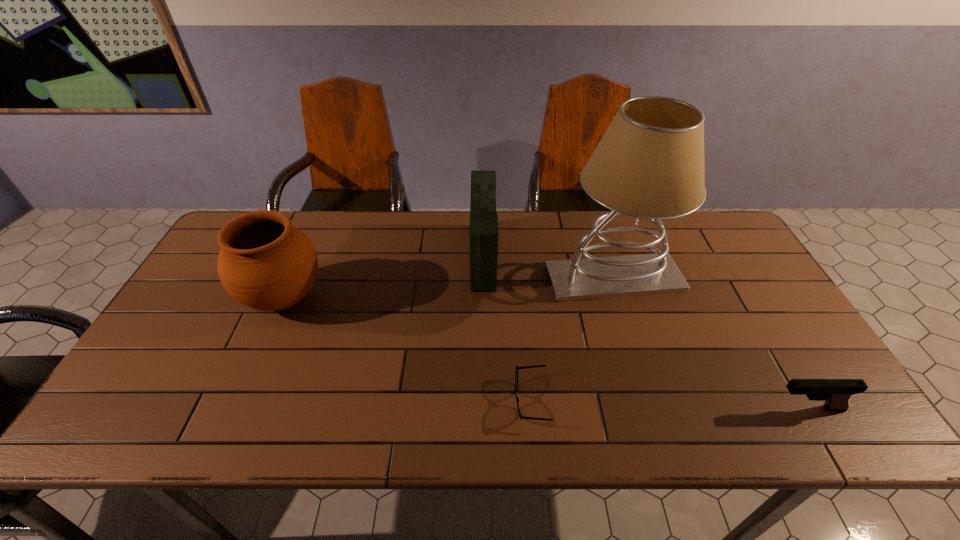
Identify the location of the first-aid kit that is at the far edge. This screenshot has width=960, height=540. (483, 218).

Find the location of `pistol that is at the near edge`. pistol that is at the near edge is located at coordinates (836, 393).

Locate an element on the screen. spectacles that is at the near edge is located at coordinates (524, 367).

Where is `object that is at the left edge`? object that is at the left edge is located at coordinates (265, 263).

At what (x,y) coordinates should I click in order to perform the action: click on object that is at the right edge. Please return your answer as a coordinate pair (x, y). The image size is (960, 540). Looking at the image, I should click on [836, 393].

At what (x,y) coordinates should I click in order to perform the action: click on object that is at the near right corner. Please return your answer as a coordinate pair (x, y). This screenshot has height=540, width=960. Looking at the image, I should click on (836, 393).

In the image, there is a desktop. What are the coordinates of `free space at the far edge` in the screenshot? It's located at (319, 251).

This screenshot has height=540, width=960. In the image, there is a desktop. In order to click on free space at the near edge in this screenshot , I will do `click(500, 436)`.

This screenshot has height=540, width=960. In the image, there is a desktop. What are the coordinates of `vacant space at the left edge` in the screenshot? It's located at (176, 362).

Where is `vacant space at the right edge of the desktop`? The height and width of the screenshot is (540, 960). vacant space at the right edge of the desktop is located at coordinates (793, 379).